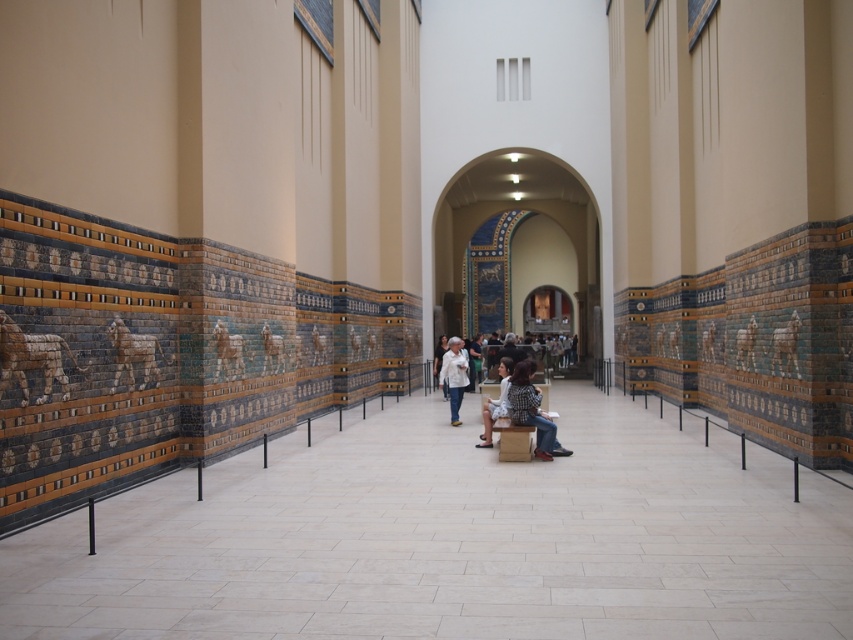
You are a visitor in the museum and see two items displayed at the center of the room. The items are the checkered shirt at center and the white fabric dress at center. Which one is taller?

The checkered shirt at center is taller than the white fabric dress at center.